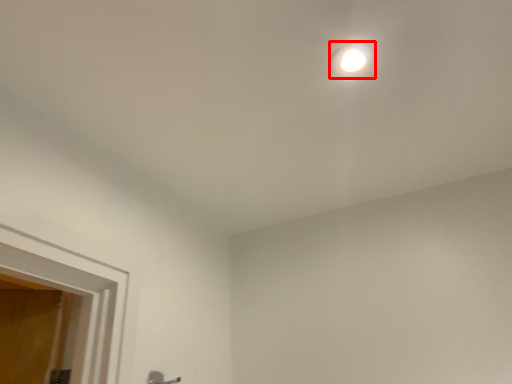
Question: Where is droplight (annotated by the red box) located in relation to door handle in the image?

Choices:
 (A) left
 (B) right

Answer: (B)